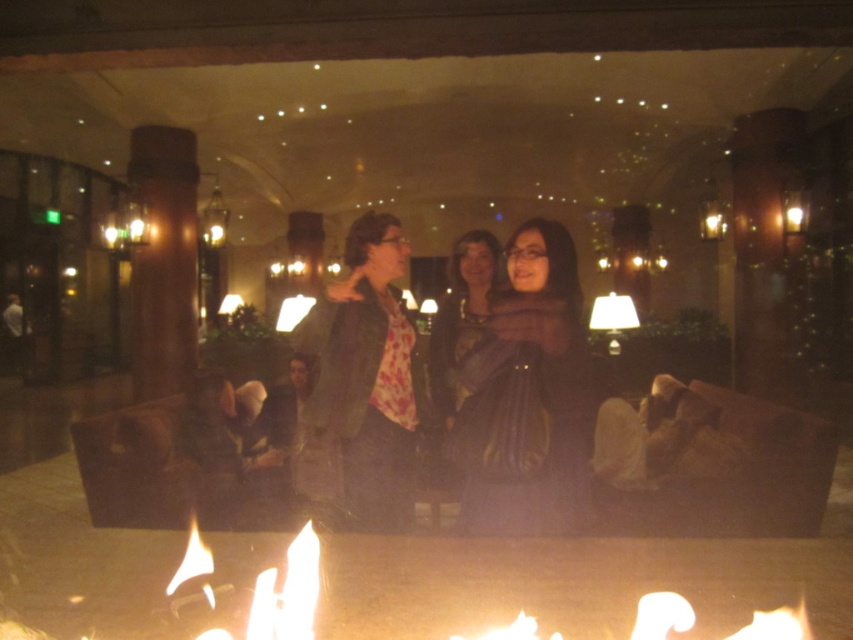
You are standing in the lounge and want to grab the matte black jacket at center without getting too close to the flamefire at lower center. Can you reach it while staying at least 1 meter away from the flamefire?

The flamefire at lower center is closer to the viewer than the matte black jacket at center. Since the jacket is farther away, you can reach it while maintaining a safe distance of at least 1 meter from the flamefire.